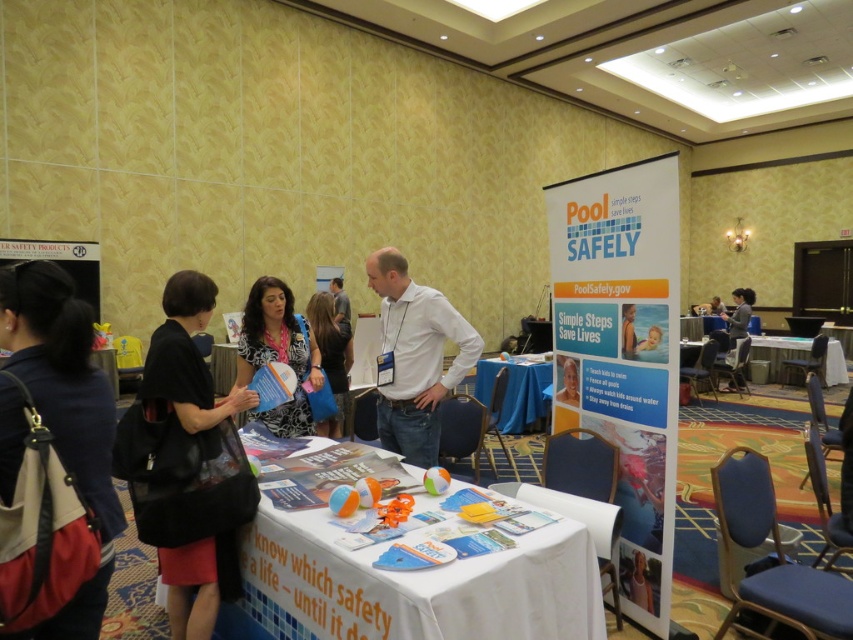
Question: Which point is farther from the camera taking this photo?

Choices:
 (A) (578, 381)
 (B) (195, 604)

Answer: (A)

Question: Estimate the real-world distances between objects in this image. Which object is closer to the dark gray fabric chair at right?

Choices:
 (A) black leather bag at left
 (B) zebra print dress at center

Answer: (B)

Question: Can you confirm if white matte shirt at center is positioned to the left of blue fabric table at center?

Choices:
 (A) no
 (B) yes

Answer: (B)

Question: Which of the following is the farthest from the observer?

Choices:
 (A) (335, 369)
 (B) (463, 352)
 (C) (285, 321)

Answer: (A)

Question: Observing the image, what is the correct spatial positioning of zebra print dress at center in reference to blue fabric table at center?

Choices:
 (A) below
 (B) above

Answer: (B)

Question: In this image, where is red leather backpack at left located relative to zebra print dress at center?

Choices:
 (A) right
 (B) left

Answer: (B)